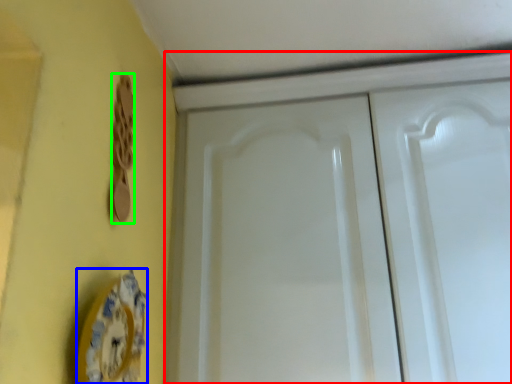
Question: Which object is the closest to the cabinetry (highlighted by a red box)? Choose among these: plate (highlighted by a blue box) or door handle (highlighted by a green box).

Choices:
 (A) plate
 (B) door handle

Answer: (B)